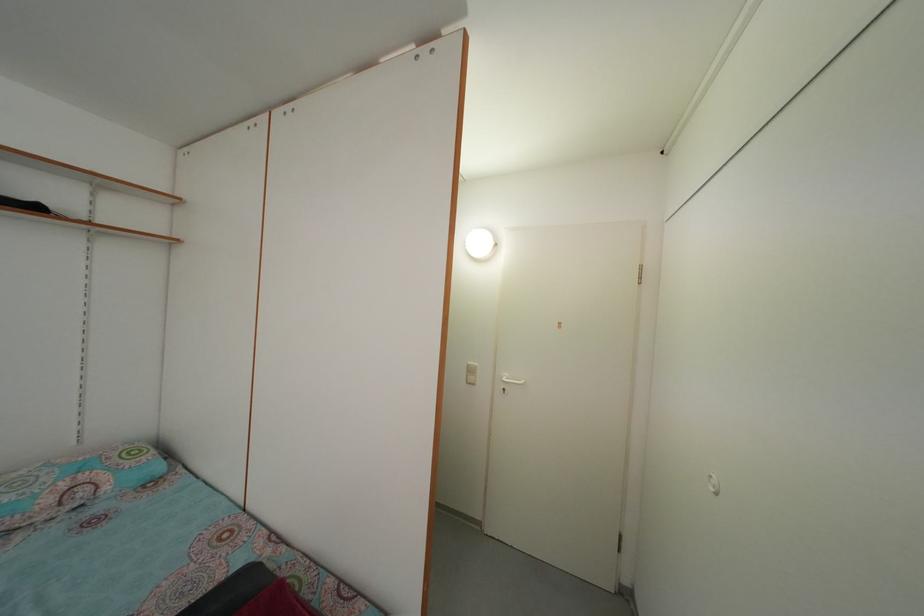
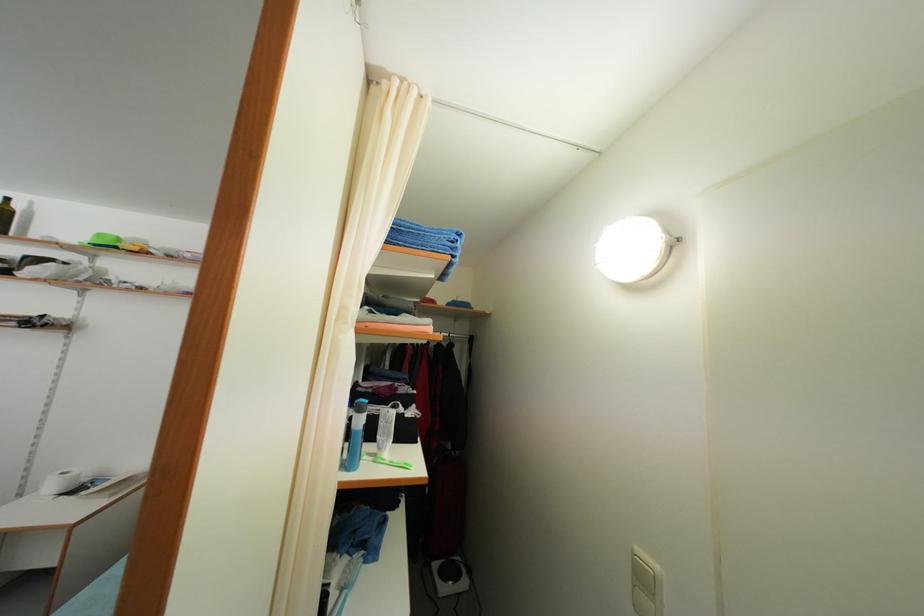
Locate, in the second image, the point that corresponds to (x=477, y=378) in the first image.

(649, 586)